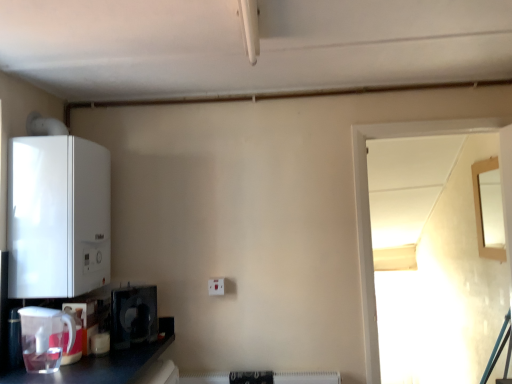
In the scene shown: What is the approximate width of wooden framed mirror at upper right, the 2th window from the left?

It is 1.81 inches.

What do you see at coordinates (368, 209) in the screenshot? I see `transparent glass door at right, acting as the second window starting from the right` at bounding box center [368, 209].

Find the location of a particular element. wooden framed mirror at upper right, the 1th window when ordered from right to left is located at coordinates (489, 209).

From a real-world perspective, is matte white kettle at lower left, the fourth appliance from the top, positioned over white glossy boiler at left, the 1th appliance from the top, based on gravity?

No, from a real-world perspective, matte white kettle at lower left, the fourth appliance from the top, is not above white glossy boiler at left, the 1th appliance from the top.

Considering the positions of points (80, 320) and (30, 241), is point (80, 320) farther from camera compared to point (30, 241)?

Yes, point (80, 320) is behind point (30, 241).

The width and height of the screenshot is (512, 384). I want to click on appliance that is the 3rd object directly below the white glossy boiler at left, the 1th appliance from the top (from a real-world perspective), so click(75, 337).

Consider the image. Can you see matte white kettle at lower left, which is the first appliance from bottom to top, touching white glossy boiler at left, the 1th appliance from the top?

No, matte white kettle at lower left, which is the first appliance from bottom to top, is not next to white glossy boiler at left, the 1th appliance from the top.

Considering the relative sizes of matte white kettle at lower left, which is the first appliance from bottom to top, and white plastic jug at lower left, which ranks as the 2th appliance in top-to-bottom order, in the image provided, is matte white kettle at lower left, which is the first appliance from bottom to top, smaller than white plastic jug at lower left, which ranks as the 2th appliance in top-to-bottom order,?

Yes, matte white kettle at lower left, which is the first appliance from bottom to top, is smaller than white plastic jug at lower left, which ranks as the 2th appliance in top-to-bottom order.

Do you think matte white kettle at lower left, which is the first appliance from bottom to top, is within white plastic jug at lower left, which ranks as the 2th appliance in top-to-bottom order, or outside of it?

matte white kettle at lower left, which is the first appliance from bottom to top, lies outside white plastic jug at lower left, which ranks as the 2th appliance in top-to-bottom order.

Is matte white kettle at lower left, which is the first appliance from bottom to top, wider or thinner than white plastic jug at lower left, which ranks as the 2th appliance in top-to-bottom order?

matte white kettle at lower left, which is the first appliance from bottom to top, is thinner than white plastic jug at lower left, which ranks as the 2th appliance in top-to-bottom order.

Is transparent glass door at right, acting as the second window starting from the right, bigger than white glossy boiler at left, which is the fourth appliance in bottom-to-top order?

No, transparent glass door at right, acting as the second window starting from the right, is not bigger than white glossy boiler at left, which is the fourth appliance in bottom-to-top order.

Is transparent glass door at right, acting as the second window starting from the right, closer to the viewer compared to white glossy boiler at left, which is the fourth appliance in bottom-to-top order?

No, it is behind white glossy boiler at left, which is the fourth appliance in bottom-to-top order.

Between transparent glass door at right, which appears as the first window when viewed from the left, and white glossy boiler at left, the 1th appliance from the top, which one has smaller width?

transparent glass door at right, which appears as the first window when viewed from the left.

In the image, is transparent glass door at right, which appears as the second window when viewed from the back, on the left side or the right side of white glossy boiler at left, the 1th appliance from the top?

transparent glass door at right, which appears as the second window when viewed from the back, is to the right of white glossy boiler at left, the 1th appliance from the top.

Looking at this image, based on their sizes in the image, would you say black plastic microwave at lower left, the second appliance in the bottom-to-top sequence, is bigger or smaller than matte white kettle at lower left, the fourth appliance from the top?

Clearly, black plastic microwave at lower left, the second appliance in the bottom-to-top sequence, is larger in size than matte white kettle at lower left, the fourth appliance from the top.

Does black plastic microwave at lower left, which ranks as the 3th appliance in top-to-bottom order, have a greater height compared to matte white kettle at lower left, the fourth appliance from the top?

Correct, black plastic microwave at lower left, which ranks as the 3th appliance in top-to-bottom order, is much taller as matte white kettle at lower left, the fourth appliance from the top.

From the image's perspective, between black plastic microwave at lower left, the second appliance in the bottom-to-top sequence, and matte white kettle at lower left, the fourth appliance from the top, which one is located above?

black plastic microwave at lower left, the second appliance in the bottom-to-top sequence, is shown above in the image.

Which object is further away from the camera taking this photo, transparent glass door at right, which appears as the second window when viewed from the back, or white plastic electric outlet at center?

white plastic electric outlet at center is more distant.

Can you confirm if transparent glass door at right, which appears as the second window when viewed from the back, is bigger than white plastic electric outlet at center?

Indeed, transparent glass door at right, which appears as the second window when viewed from the back, has a larger size compared to white plastic electric outlet at center.

From a real-world perspective, is transparent glass door at right, which appears as the first window when viewed from the left, beneath white plastic electric outlet at center?

No, from a real-world perspective, transparent glass door at right, which appears as the first window when viewed from the left, is not under white plastic electric outlet at center.

There is a white plastic electric outlet at center. Identify the location of the 1st window above it (from the image's perspective). (368, 209).

From the image's perspective, is matte white kettle at lower left, which is the first appliance from bottom to top, on white plastic electric outlet at center?

Incorrect, from the image's perspective, matte white kettle at lower left, which is the first appliance from bottom to top, is lower than white plastic electric outlet at center.

Is matte white kettle at lower left, the fourth appliance from the top, to the left or to the right of white plastic electric outlet at center in the image?

From the image, it's evident that matte white kettle at lower left, the fourth appliance from the top, is to the left of white plastic electric outlet at center.

From a real-world perspective, who is located lower, matte white kettle at lower left, the fourth appliance from the top, or white plastic electric outlet at center?

matte white kettle at lower left, the fourth appliance from the top.

Is transparent glass door at right, which appears as the second window when viewed from the back, in front of or behind white plastic jug at lower left, marked as the 3th appliance in a bottom-to-top arrangement, in the image?

Clearly, transparent glass door at right, which appears as the second window when viewed from the back, is behind white plastic jug at lower left, marked as the 3th appliance in a bottom-to-top arrangement.

How many degrees apart are the facing directions of transparent glass door at right, which appears as the second window when viewed from the back, and white plastic jug at lower left, which ranks as the 2th appliance in top-to-bottom order?

There is a 90-degree angle between the facing directions of transparent glass door at right, which appears as the second window when viewed from the back, and white plastic jug at lower left, which ranks as the 2th appliance in top-to-bottom order.

Looking at this image, which object is positioned more to the left, transparent glass door at right, which appears as the second window when viewed from the back, or white plastic jug at lower left, which ranks as the 2th appliance in top-to-bottom order?

Positioned to the left is white plastic jug at lower left, which ranks as the 2th appliance in top-to-bottom order.

Where is `the 1st window located above the white plastic jug at lower left, which ranks as the 2th appliance in top-to-bottom order (from a real-world perspective)`? Image resolution: width=512 pixels, height=384 pixels. the 1st window located above the white plastic jug at lower left, which ranks as the 2th appliance in top-to-bottom order (from a real-world perspective) is located at coordinates (368, 209).

There is a matte white kettle at lower left, the fourth appliance from the top. Where is `the 3rd appliance above it (from the image's perspective)`? the 3rd appliance above it (from the image's perspective) is located at coordinates (58, 217).

Identify the location of appliance that is the 1st object to the left of the matte white kettle at lower left, which is the first appliance from bottom to top, starting at the anchor. (45, 338).

From the image, which object appears to be nearer to wooden framed mirror at upper right, which appears as the 1th window when viewed from the back, transparent glass door at right, acting as the second window starting from the right, or white plastic electric outlet at center?

transparent glass door at right, acting as the second window starting from the right, is positioned closer to the anchor wooden framed mirror at upper right, which appears as the 1th window when viewed from the back.

When comparing their distances from wooden framed mirror at upper right, acting as the second window starting from the front, does black plastic microwave at lower left, the second appliance in the bottom-to-top sequence, or transparent glass door at right, acting as the second window starting from the right, seem closer?

The object closer to wooden framed mirror at upper right, acting as the second window starting from the front, is transparent glass door at right, acting as the second window starting from the right.

Based on their spatial positions, is wooden framed mirror at upper right, the 2th window from the left, or white plastic electric outlet at center closer to black plastic microwave at lower left, the second appliance in the bottom-to-top sequence?

white plastic electric outlet at center.

Based on their spatial positions, is white plastic jug at lower left, which ranks as the 2th appliance in top-to-bottom order, or white plastic electric outlet at center closer to wooden framed mirror at upper right, acting as the second window starting from the front?

white plastic electric outlet at center lies closer to wooden framed mirror at upper right, acting as the second window starting from the front, than the other object.

Estimate the real-world distances between objects in this image. Which object is closer to black plastic microwave at lower left, which ranks as the 3th appliance in top-to-bottom order, wooden framed mirror at upper right, which appears as the 1th window when viewed from the back, or matte white kettle at lower left, which is the first appliance from bottom to top?

matte white kettle at lower left, which is the first appliance from bottom to top, lies closer to black plastic microwave at lower left, which ranks as the 3th appliance in top-to-bottom order, than the other object.

Looking at the image, which one is located closer to white plastic electric outlet at center, matte white kettle at lower left, which is the first appliance from bottom to top, or transparent glass door at right, which appears as the second window when viewed from the back?

matte white kettle at lower left, which is the first appliance from bottom to top, lies closer to white plastic electric outlet at center than the other object.

Based on their spatial positions, is black plastic microwave at lower left, the second appliance in the bottom-to-top sequence, or white glossy boiler at left, the 1th appliance from the top, closer to white plastic electric outlet at center?

Result: Based on the image, black plastic microwave at lower left, the second appliance in the bottom-to-top sequence, appears to be nearer to white plastic electric outlet at center.

Considering their positions, is wooden framed mirror at upper right, the 2th window from the left, positioned further to transparent glass door at right, acting as the second window starting from the right, than matte white kettle at lower left, which is the first appliance from bottom to top?

Based on the image, matte white kettle at lower left, which is the first appliance from bottom to top, appears to be further to transparent glass door at right, acting as the second window starting from the right.

Find the location of a particular element. This screenshot has height=384, width=512. appliance between matte white kettle at lower left, which is the first appliance from bottom to top, and transparent glass door at right, positioned as the 1th window in front-to-back order, from left to right is located at coordinates (133, 316).

Find the location of a particular element. The width and height of the screenshot is (512, 384). electric outlet located between black plastic microwave at lower left, the second appliance in the bottom-to-top sequence, and transparent glass door at right, which appears as the first window when viewed from the left, in the left-right direction is located at coordinates (216, 286).

This screenshot has width=512, height=384. I want to click on window between white glossy boiler at left, the 1th appliance from the top, and wooden framed mirror at upper right, which appears as the 1th window when viewed from the back, from left to right, so click(x=368, y=209).

Identify the location of appliance between matte white kettle at lower left, which is the first appliance from bottom to top, and wooden framed mirror at upper right, the 2th window from the left, in the horizontal direction. (133, 316).